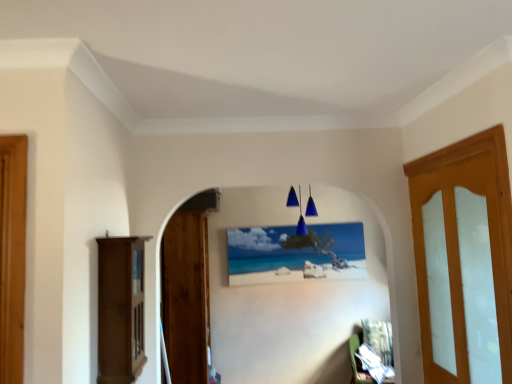
Question: Is denim fabric chair at lower right, the 1th furniture viewed from the back, not within matte canvas painting at center?

Choices:
 (A) no
 (B) yes

Answer: (B)

Question: Is denim fabric chair at lower right, the first furniture from the bottom, positioned behind matte canvas painting at center?

Choices:
 (A) no
 (B) yes

Answer: (A)

Question: Could you tell me if denim fabric chair at lower right, the 1th furniture viewed from the back, is turned towards matte canvas painting at center?

Choices:
 (A) no
 (B) yes

Answer: (A)

Question: Does denim fabric chair at lower right, which ranks as the 1th furniture in right-to-left order, have a lesser height compared to matte canvas painting at center?

Choices:
 (A) yes
 (B) no

Answer: (A)

Question: Does denim fabric chair at lower right, which ranks as the 1th furniture in right-to-left order, have a lesser width compared to matte canvas painting at center?

Choices:
 (A) no
 (B) yes

Answer: (A)

Question: Would you say blue glass pendant lights at center is to the left or to the right of matte wood cabinet at left, which appears as the 2th furniture when ordered from the bottom, in the picture?

Choices:
 (A) right
 (B) left

Answer: (A)

Question: Considering the positions of blue glass pendant lights at center and matte wood cabinet at left, positioned as the 2th furniture in right-to-left order, in the image, is blue glass pendant lights at center bigger or smaller than matte wood cabinet at left, positioned as the 2th furniture in right-to-left order,?

Choices:
 (A) big
 (B) small

Answer: (B)

Question: From their relative heights in the image, would you say blue glass pendant lights at center is taller or shorter than matte wood cabinet at left, marked as the 1th furniture in a left-to-right arrangement?

Choices:
 (A) short
 (B) tall

Answer: (A)

Question: Does point (287, 201) appear closer or farther from the camera than point (134, 304)?

Choices:
 (A) farther
 (B) closer

Answer: (A)

Question: Do you think matte canvas painting at center is within denim fabric chair at lower right, which ranks as the 1th furniture in right-to-left order, or outside of it?

Choices:
 (A) outside
 (B) inside

Answer: (A)

Question: From the image's perspective, relative to denim fabric chair at lower right, the 2th furniture when ordered from top to bottom, is matte canvas painting at center above or below?

Choices:
 (A) below
 (B) above

Answer: (B)

Question: Is matte canvas painting at center taller or shorter than denim fabric chair at lower right, the second furniture when ordered from left to right?

Choices:
 (A) tall
 (B) short

Answer: (A)

Question: In the image, is matte canvas painting at center on the left side or the right side of denim fabric chair at lower right, the 1th furniture viewed from the back?

Choices:
 (A) right
 (B) left

Answer: (B)

Question: Considering the positions of matte canvas painting at center and light brown wooden door at right, which appears as the 1th door when viewed from the right, in the image, is matte canvas painting at center bigger or smaller than light brown wooden door at right, which appears as the 1th door when viewed from the right,?

Choices:
 (A) big
 (B) small

Answer: (B)

Question: Is point (282, 268) positioned closer to the camera than point (434, 218)?

Choices:
 (A) closer
 (B) farther

Answer: (B)